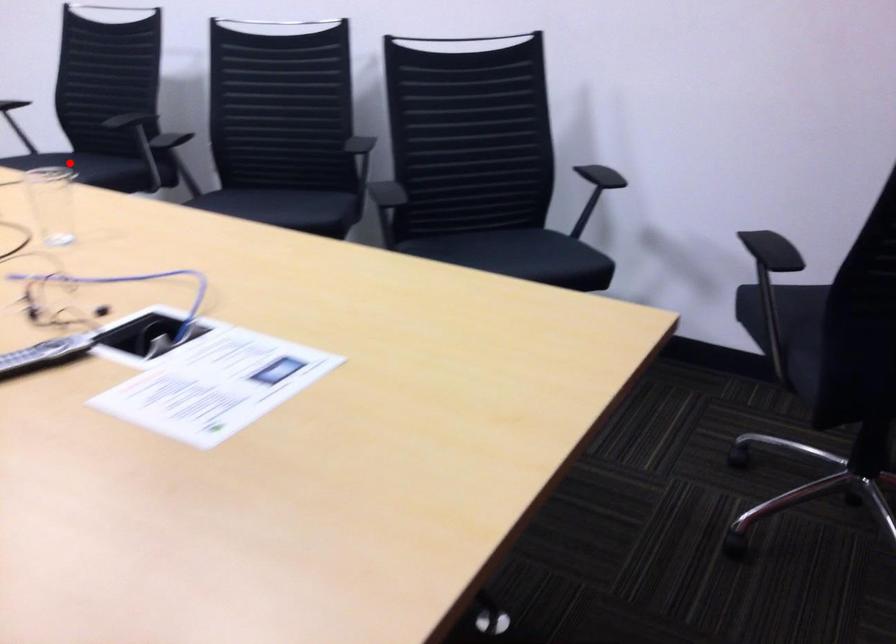
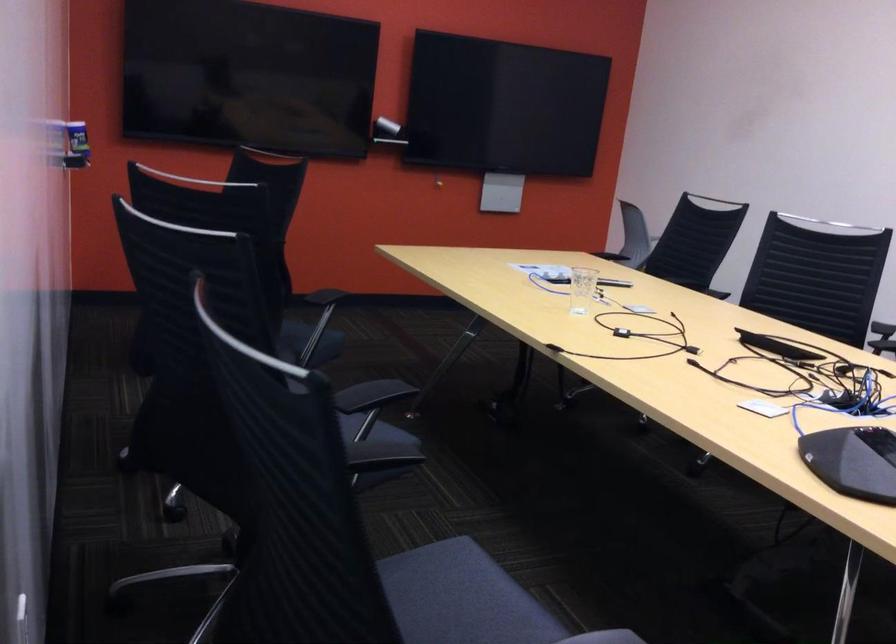
The point at the highlighted location is marked in the first image. Where is the corresponding point in the second image?

(461, 598)